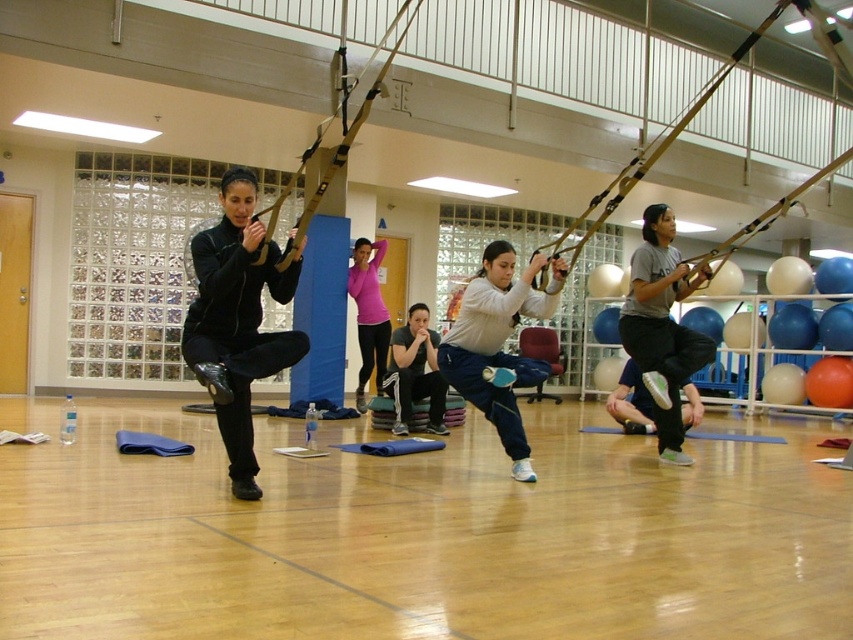
Is point (453, 356) closer to viewer compared to point (364, 289)?

That is True.

Does light gray fabric pants at center have a lesser width compared to pink fabric at center?

In fact, light gray fabric pants at center might be wider than pink fabric at center.

Is point (514, 380) farther from camera compared to point (364, 253)?

No.

This screenshot has height=640, width=853. I want to click on light gray fabric pants at center, so click(x=498, y=342).

The image size is (853, 640). Describe the element at coordinates (662, 326) in the screenshot. I see `gray fabric shirt at center` at that location.

Which of these two, gray fabric shirt at center or gray fabric sweatshirt at center, stands shorter?

Standing shorter between the two is gray fabric sweatshirt at center.

The width and height of the screenshot is (853, 640). Find the location of `gray fabric shirt at center`. gray fabric shirt at center is located at coordinates (662, 326).

Between point (476, 355) and point (399, 372), which one is positioned behind?

Positioned behind is point (399, 372).

Between light gray fabric pants at center and gray fabric sweatshirt at center, which one has more height?

light gray fabric pants at center

Who is more distant from viewer, (x=538, y=253) or (x=397, y=364)?

The point (x=397, y=364) is behind.

You are a GUI agent. You are given a task and a screenshot of the screen. Output one action in this format:
    pyautogui.click(x=<x>, y=<y>)
    Task: Click on the light gray fabric pants at center
    
    Given the screenshot: What is the action you would take?
    pyautogui.click(x=498, y=342)